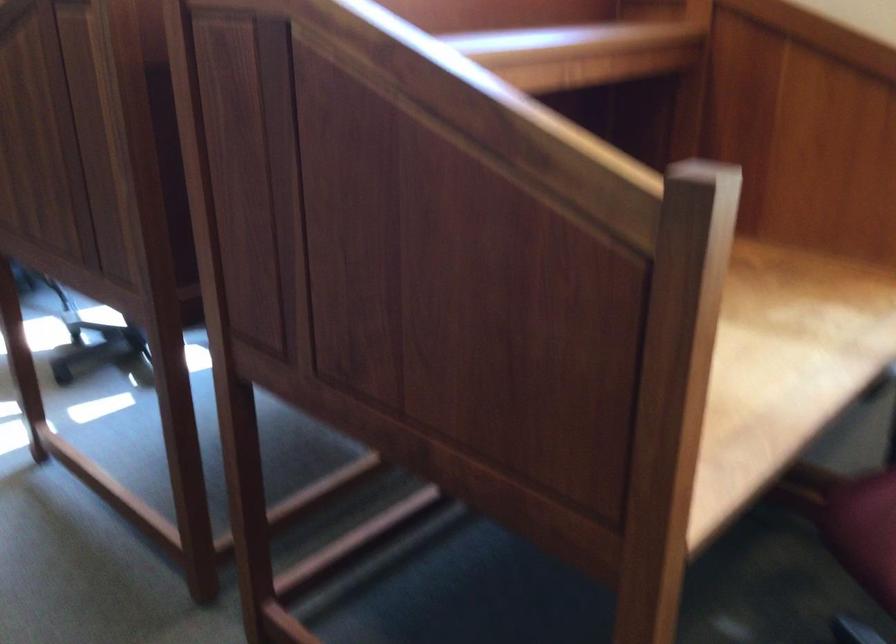
Where would you sit the chair sitting surface? Please return your answer as a coordinate pair (x, y).

(778, 360)